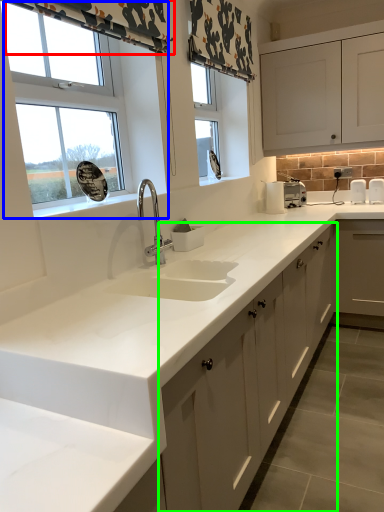
Question: Which object is the closest to the curtain (highlighted by a red box)? Choose among these: window (highlighted by a blue box) or cabinetry (highlighted by a green box).

Choices:
 (A) window
 (B) cabinetry

Answer: (A)